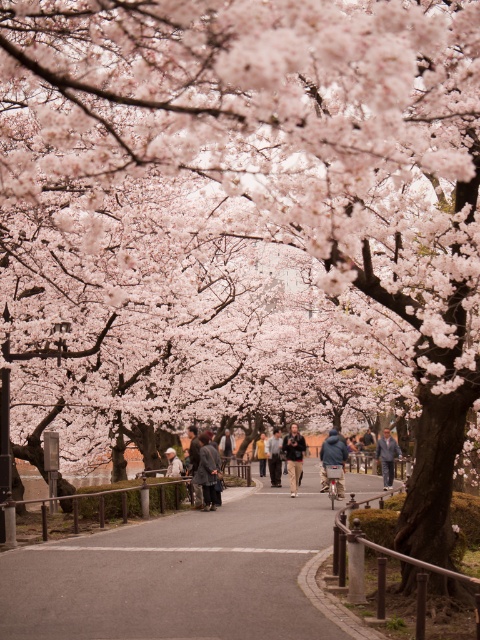
Question: Which point appears farthest from the camera in this image?

Choices:
 (A) (264, 456)
 (B) (265, 452)
 (C) (180, 468)

Answer: (A)

Question: Is dark blue jacket at center to the right of denim jacket at center from the viewer's perspective?

Choices:
 (A) no
 (B) yes

Answer: (A)

Question: Can you confirm if denim jacket at center is wider than light brown leather jacket at center?

Choices:
 (A) no
 (B) yes

Answer: (B)

Question: Estimate the real-world distances between objects in this image. Which object is closer to the dark blue jacket at center?

Choices:
 (A) light beige fabric jacket at center
 (B) blue denim jacket at center

Answer: (B)

Question: Which point is closer to the camera?

Choices:
 (A) (294, 467)
 (B) (170, 460)
 (C) (386, 448)

Answer: (A)

Question: Can you confirm if asphalt road at center is smaller than denim jacket at center?

Choices:
 (A) yes
 (B) no

Answer: (B)